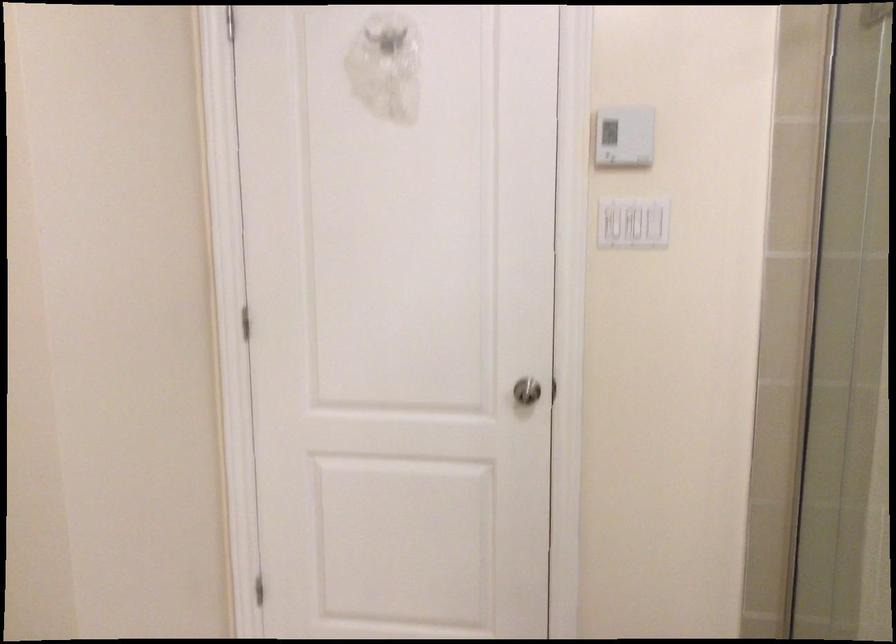
What do you see at coordinates (526, 391) in the screenshot?
I see `a silver door knob` at bounding box center [526, 391].